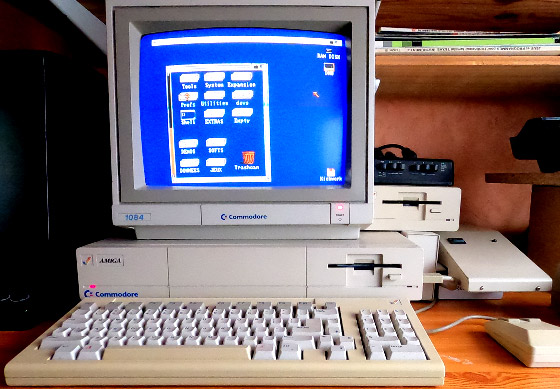
The height and width of the screenshot is (389, 560). Find the location of `wood desk`. wood desk is located at coordinates (480, 378).